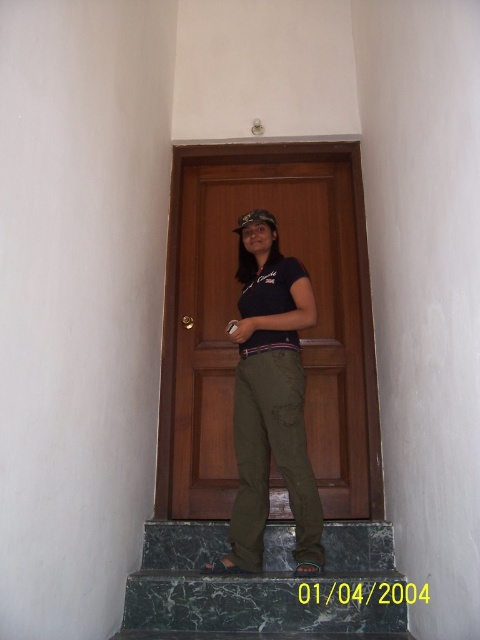
You are trying to determine which object takes up more area in the image. Based on the scene, which one is smaller in size between the green marble stairs at center and the olive green pants at center?

The green marble stairs at center occupies less space than olive green pants at center, so the green marble stairs at center is smaller in size.

You are a delivery person trying to reach the brown wooden door at center while standing on the olive green pants at center. Can you reach the door without moving your feet?

Answer: The brown wooden door at center is above olive green pants at center, so you can reach it without moving your feet as it is within arm

You are trying to determine if the olive green pants at center can fit on the green marble stairs at center. Based on their widths, will they fit?

The green marble stairs at center are wider than the olive green pants at center, so the pants can fit on the stairs.